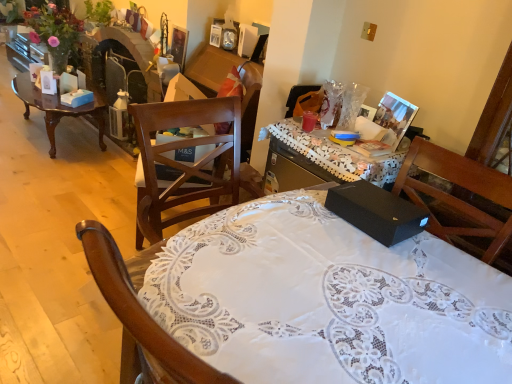
Measure the distance between point (418, 324) and camera.

Point (418, 324) is 3.78 feet away from camera.

Locate an element on the screen. black matte box at center is located at coordinates (328, 300).

From the picture: What is the approximate width of black matte box at center?

It is 23.04 centimeters.

This screenshot has width=512, height=384. What do you see at coordinates (56, 109) in the screenshot?
I see `wooden polished coffee table at left` at bounding box center [56, 109].

Identify the location of black matte box at center. Image resolution: width=512 pixels, height=384 pixels. (328, 300).

Considering the sizes of objects brown wooden chair at center and black matte box at center in the image provided, who is thinner, brown wooden chair at center or black matte box at center?

With smaller width is brown wooden chair at center.

Is brown wooden chair at center taller or shorter than black matte box at center?

brown wooden chair at center is shorter than black matte box at center.

Measure the distance from brown wooden chair at center to black matte box at center.

The distance of brown wooden chair at center from black matte box at center is 25.25 inches.

Is brown wooden chair at center to the left of black matte box at center from the viewer's perspective?

Correct, you'll find brown wooden chair at center to the left of black matte box at center.

Between black matte box at center and brown wooden chair at center, which one appears on the right side from the viewer's perspective?

black matte box at center is more to the right.

Are black matte box at center and brown wooden chair at center far apart?

No, black matte box at center is not far away from brown wooden chair at center.

There is a brown wooden chair at center. Where is `desk above it (from a real-world perspective)`? desk above it (from a real-world perspective) is located at coordinates click(328, 300).

Considering the relative sizes of black matte box at center and brown wooden chair at center in the image provided, is black matte box at center thinner than brown wooden chair at center?

Incorrect, the width of black matte box at center is not less than that of brown wooden chair at center.

Which of these two, brown wooden chair at center or matte plastic cup at center, is wider?

brown wooden chair at center is wider.

Is brown wooden chair at center looking in the opposite direction of matte plastic cup at center?

No, brown wooden chair at center is not facing the opposite direction of matte plastic cup at center.

Considering the positions of points (144, 212) and (310, 124), is point (144, 212) farther from camera compared to point (310, 124)?

No, it is not.

From the image's perspective, between black matte box at center and matte plastic cup at center, which one is located above?

From the image's view, matte plastic cup at center is above.

Does black matte box at center have a larger size compared to matte plastic cup at center?

Yes.

Identify the location of coffee cup that appears above the black matte box at center (from the image's perspective). Image resolution: width=512 pixels, height=384 pixels. (309, 121).

Consider the image. Which is more to the left, black matte box at center or black matte box at center?

From the viewer's perspective, black matte box at center appears more on the left side.

From a real-world perspective, is black matte box at center over black matte box at center?

Yes, from a real-world perspective, black matte box at center is on top of black matte box at center.

Does black matte box at center have a smaller size compared to black matte box at center?

Yes.

Which is farther, (394,230) or (422,373)?

The point (394,230) is farther.

Considering their positions, is black matte box at center located in front of or behind brown wooden chair at center?

black matte box at center is positioned closer to the viewer than brown wooden chair at center.

Between black matte box at center and brown wooden chair at center, which one has smaller size?

black matte box at center is smaller.

Which object is wider, black matte box at center or brown wooden chair at center?

With larger width is brown wooden chair at center.

From the image's perspective, which object appears higher, black matte box at center or black matte box at center?

From the image's view, black matte box at center is above.

Considering the sizes of black matte box at center and black matte box at center in the image, is black matte box at center bigger or smaller than black matte box at center?

Clearly, black matte box at center is larger in size than black matte box at center.

Is black matte box at center turned away from black matte box at center?

No, black matte box at center's orientation is not away from black matte box at center.

Is black matte box at center at the left side of black matte box at center?

Correct, you'll find black matte box at center to the left of black matte box at center.

Locate an element on the screen. desk that is in front of the brown wooden chair at center is located at coordinates (328, 300).

Locate an element on the screen. chair on the left of black matte box at center is located at coordinates (184, 164).

Based on their spatial positions, is wooden polished coffee table at left or black matte box at center closer to matte plastic cup at center?

Among the two, black matte box at center is located nearer to matte plastic cup at center.

Looking at this image, looking at the image, which one is located closer to brown wooden chair at center, black matte box at center or matte plastic cup at center?

Based on the image, black matte box at center appears to be nearer to brown wooden chair at center.

From the image, which object appears to be farther from black matte box at center, matte plastic cup at center or black matte box at center?

matte plastic cup at center lies further to black matte box at center than the other object.

Which object lies nearer to the anchor point black matte box at center, wooden polished coffee table at left or matte plastic cup at center?

matte plastic cup at center.

Based on their spatial positions, is black matte box at center or brown wooden chair at center closer to wooden polished coffee table at left?

brown wooden chair at center is closer to wooden polished coffee table at left.

Consider the image. When comparing their distances from brown wooden chair at center, does matte plastic cup at center or black matte box at center seem closer?

black matte box at center is closer to brown wooden chair at center.

Based on their spatial positions, is matte plastic cup at center or brown wooden chair at center closer to black matte box at center?

brown wooden chair at center lies closer to black matte box at center than the other object.

From the image, which object appears to be nearer to black matte box at center, brown wooden chair at center or matte plastic cup at center?

Among the two, brown wooden chair at center is located nearer to black matte box at center.

The width and height of the screenshot is (512, 384). Find the location of `coffee cup located between wooden polished coffee table at left and black matte box at center in the left-right direction`. coffee cup located between wooden polished coffee table at left and black matte box at center in the left-right direction is located at coordinates (309, 121).

Where is `box positioned between black matte box at center and brown wooden chair at center from near to far`? The image size is (512, 384). box positioned between black matte box at center and brown wooden chair at center from near to far is located at coordinates (376, 212).

You are a GUI agent. You are given a task and a screenshot of the screen. Output one action in this format:
    pyautogui.click(x=<x>, y=<y>)
    Task: Click on the chair situated between wooden polished coffee table at left and black matte box at center from left to right
    
    Given the screenshot: What is the action you would take?
    pyautogui.click(x=184, y=164)

The width and height of the screenshot is (512, 384). Identify the location of coffee cup between brown wooden chair at center and black matte box at center in the horizontal direction. (309, 121).